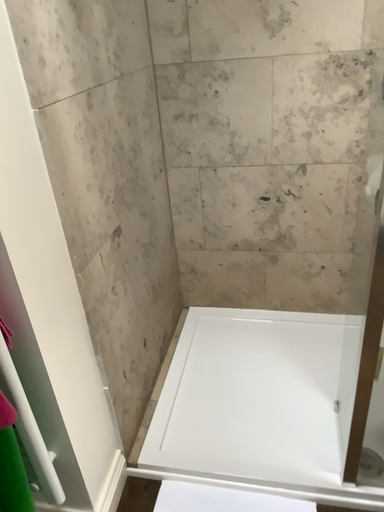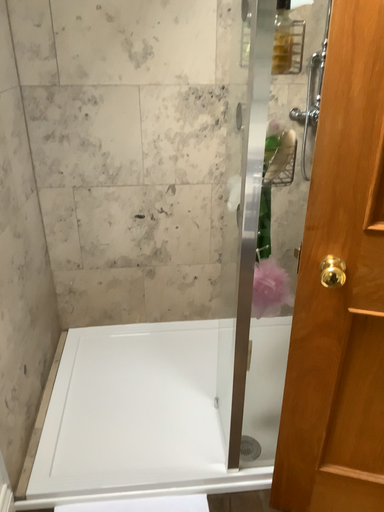
Question: Which way did the camera rotate in the video?

Choices:
 (A) rotated left
 (B) rotated right

Answer: (B)